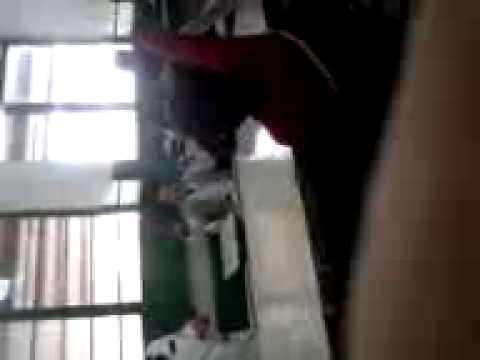
Locate an element on the screen. Image resolution: width=480 pixels, height=360 pixels. panes on the right window is located at coordinates (21, 61), (39, 61), (62, 68).